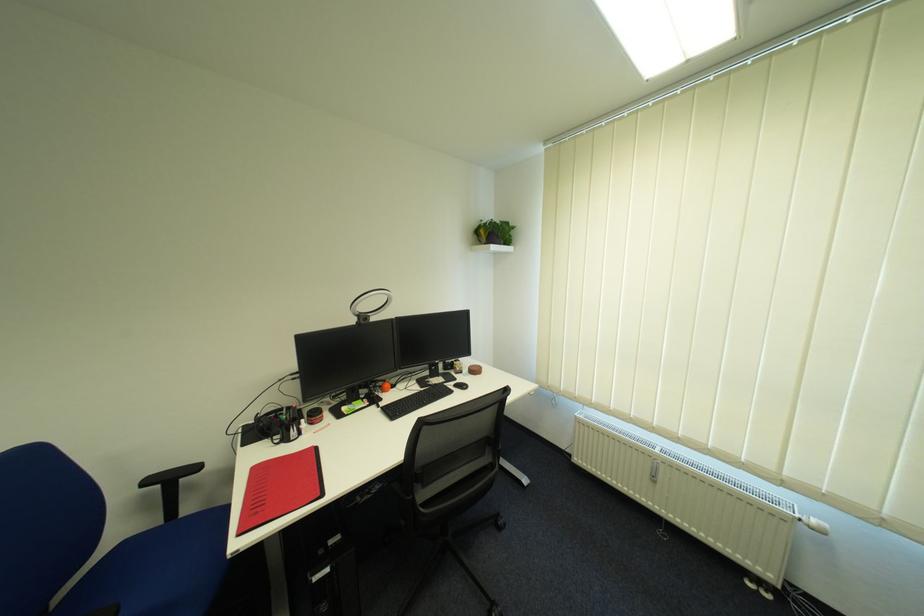
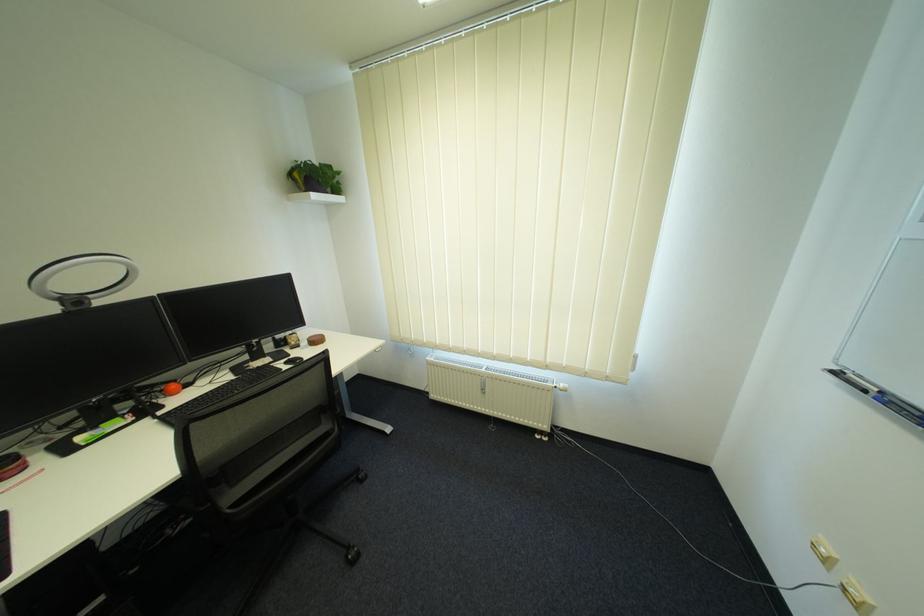
Question: The images are taken continuously from a first-person perspective. In which direction is your viewpoint rotating?

Choices:
 (A) Left
 (B) Right
 (C) Up
 (D) Down

Answer: (B)